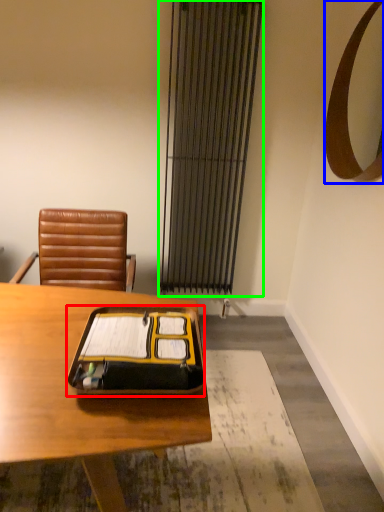
Question: Considering the real-world distances, which object is closest to notebook (highlighted by a red box)? mirror (highlighted by a blue box) or curtain (highlighted by a green box).

Choices:
 (A) mirror
 (B) curtain

Answer: (A)